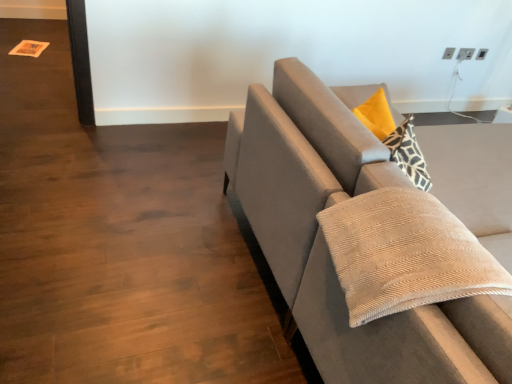
Question: Can you confirm if beige corduroy pillow at right is taller than velvet gray couch at right?

Choices:
 (A) no
 (B) yes

Answer: (A)

Question: Could velvet gray couch at right be considered to be inside beige corduroy pillow at right?

Choices:
 (A) no
 (B) yes

Answer: (A)

Question: Is beige corduroy pillow at right next to velvet gray couch at right?

Choices:
 (A) yes
 (B) no

Answer: (B)

Question: Is beige corduroy pillow at right positioned before velvet gray couch at right?

Choices:
 (A) yes
 (B) no

Answer: (A)

Question: Considering the relative sizes of beige corduroy pillow at right and velvet gray couch at right in the image provided, is beige corduroy pillow at right smaller than velvet gray couch at right?

Choices:
 (A) no
 (B) yes

Answer: (B)

Question: Considering the relative sizes of beige corduroy pillow at right and velvet gray couch at right in the image provided, is beige corduroy pillow at right wider than velvet gray couch at right?

Choices:
 (A) no
 (B) yes

Answer: (A)

Question: Is velvet gray couch at right positioned with its back to beige corduroy pillow at right?

Choices:
 (A) yes
 (B) no

Answer: (B)

Question: Can you confirm if velvet gray couch at right is taller than beige corduroy pillow at right?

Choices:
 (A) no
 (B) yes

Answer: (B)

Question: From a real-world perspective, is velvet gray couch at right positioned over beige corduroy pillow at right based on gravity?

Choices:
 (A) yes
 (B) no

Answer: (B)

Question: Considering the relative sizes of velvet gray couch at right and beige corduroy pillow at right in the image provided, is velvet gray couch at right smaller than beige corduroy pillow at right?

Choices:
 (A) no
 (B) yes

Answer: (A)

Question: Can we say velvet gray couch at right lies outside beige corduroy pillow at right?

Choices:
 (A) no
 (B) yes

Answer: (B)

Question: Does velvet gray couch at right come in front of beige corduroy pillow at right?

Choices:
 (A) no
 (B) yes

Answer: (A)

Question: Looking at their shapes, would you say beige corduroy pillow at right is wider or thinner than velvet gray couch at right?

Choices:
 (A) thin
 (B) wide

Answer: (A)